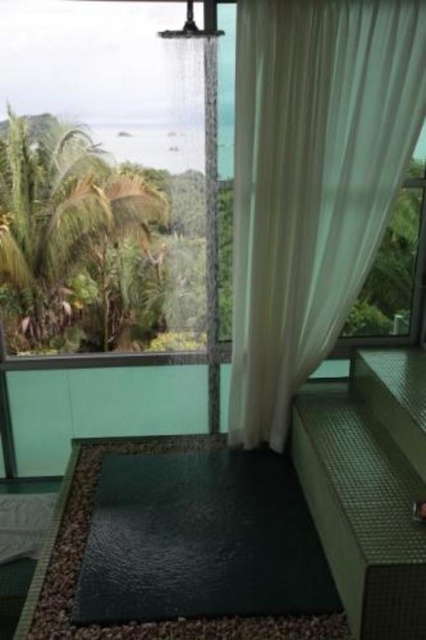
Question: Among these points, which one is nearest to the camera?

Choices:
 (A) (68, 269)
 (B) (265, 349)

Answer: (B)

Question: Is white sheer curtain at upper center smaller than transparent glass window at upper left?

Choices:
 (A) yes
 (B) no

Answer: (A)

Question: Is the position of white sheer curtain at upper center more distant than that of transparent glass window at upper left?

Choices:
 (A) no
 (B) yes

Answer: (A)

Question: Is white sheer curtain at upper center smaller than transparent glass window at upper left?

Choices:
 (A) no
 (B) yes

Answer: (B)